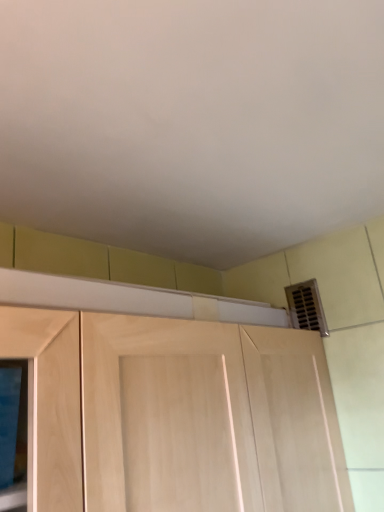
Where is `light wood cupboard at center`? light wood cupboard at center is located at coordinates (170, 401).

This screenshot has height=512, width=384. What do you see at coordinates (170, 401) in the screenshot?
I see `light wood cupboard at center` at bounding box center [170, 401].

You are a GUI agent. You are given a task and a screenshot of the screen. Output one action in this format:
    pyautogui.click(x=<x>, y=<y>)
    Task: Click on the light wood cupboard at center
    The image size is (384, 512).
    Given the screenshot: What is the action you would take?
    170,401